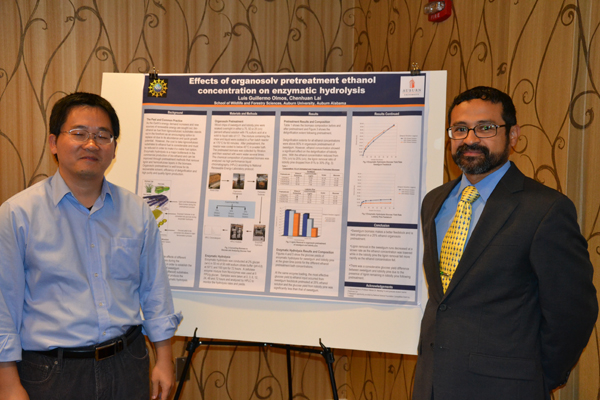
Locate an element on the screen. The width and height of the screenshot is (600, 400). posterboard is located at coordinates (235, 270).